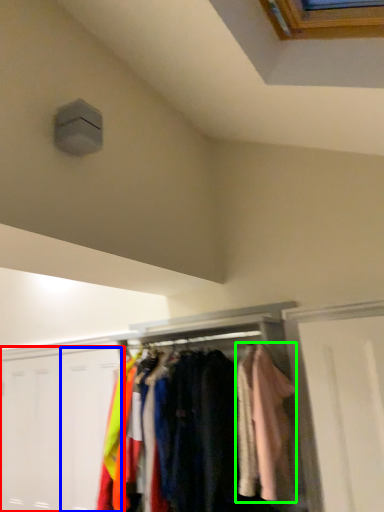
Question: Which object is the closest to the door (highlighted by a red box)? Choose among these: door (highlighted by a blue box) or clothing (highlighted by a green box).

Choices:
 (A) door
 (B) clothing

Answer: (A)